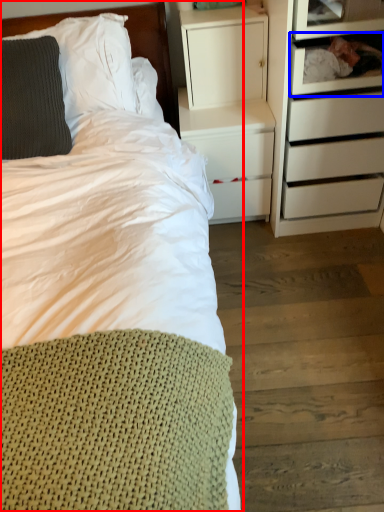
Question: Among these objects, which one is nearest to the camera, bed (highlighted by a red box) or shelf (highlighted by a blue box)?

Choices:
 (A) bed
 (B) shelf

Answer: (A)